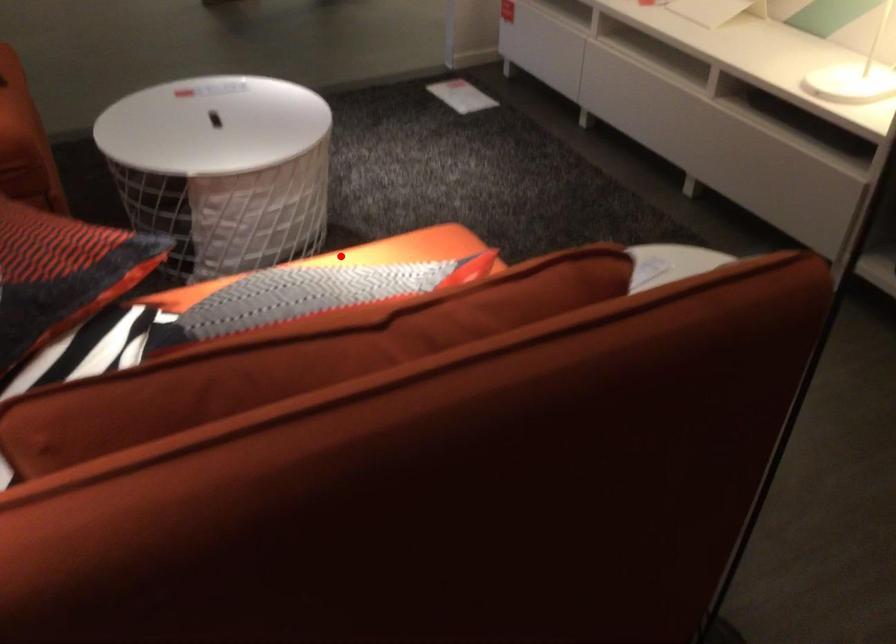
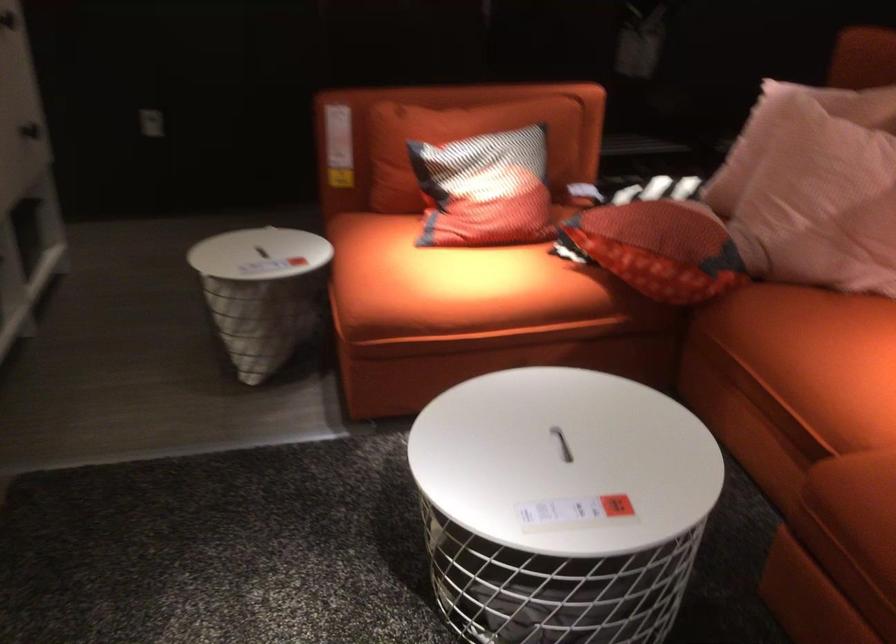
Locate, in the second image, the point that corresponds to the highlighted location in the first image.

(449, 281)